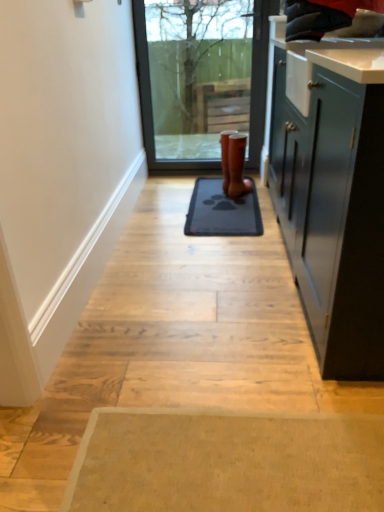
Question: Is brown leather boot at center in front of or behind transparent glass door at center in the image?

Choices:
 (A) behind
 (B) front

Answer: (B)

Question: From a real-world perspective, relative to transparent glass door at center, is brown leather boot at center vertically above or below?

Choices:
 (A) above
 (B) below

Answer: (B)

Question: Estimate the real-world distances between objects in this image. Which object is closer to the brown leather boot at center?

Choices:
 (A) gray rubber mat at center
 (B) transparent glass door at center

Answer: (A)

Question: Which is farther from the gray rubber mat at center?

Choices:
 (A) transparent glass door at center
 (B) brown leather boot at center

Answer: (A)